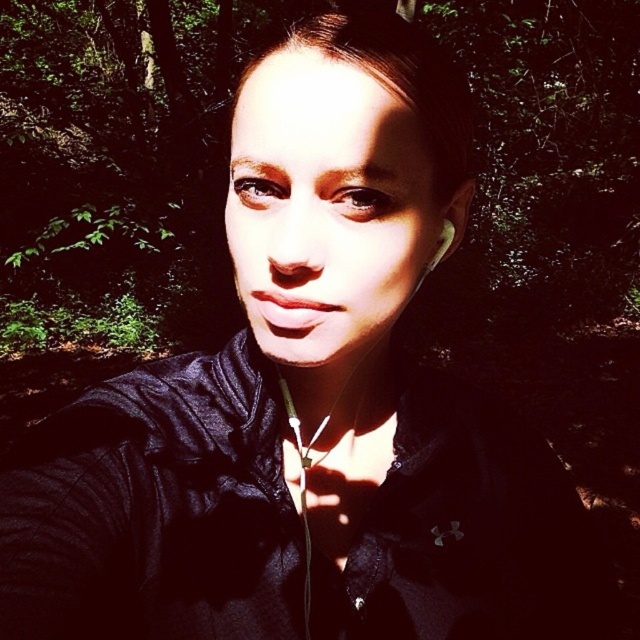
Question: Considering the relative positions of black matte jacket at center and silver metallic earring at upper right in the image provided, where is black matte jacket at center located with respect to silver metallic earring at upper right?

Choices:
 (A) right
 (B) left

Answer: (B)

Question: Is black matte jacket at center positioned behind silver metallic earring at upper right?

Choices:
 (A) yes
 (B) no

Answer: (B)

Question: Which object is closer to the camera taking this photo?

Choices:
 (A) silver metallic earring at upper right
 (B) black matte jacket at center

Answer: (B)

Question: Which point appears closest to the camera in this image?

Choices:
 (A) (524, 572)
 (B) (424, 275)

Answer: (B)

Question: Is black matte jacket at center below silver metallic earring at upper right?

Choices:
 (A) no
 (B) yes

Answer: (B)

Question: Which object appears closest to the camera in this image?

Choices:
 (A) black matte jacket at center
 (B) silver metallic earring at upper right

Answer: (A)